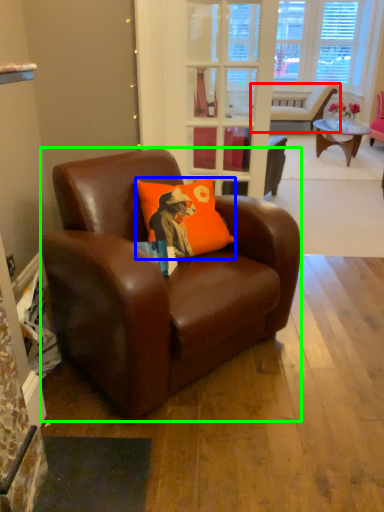
Question: Which is farther away from chair (highlighted by a red box)? pillow (highlighted by a blue box) or chair (highlighted by a green box)?

Choices:
 (A) pillow
 (B) chair

Answer: (B)